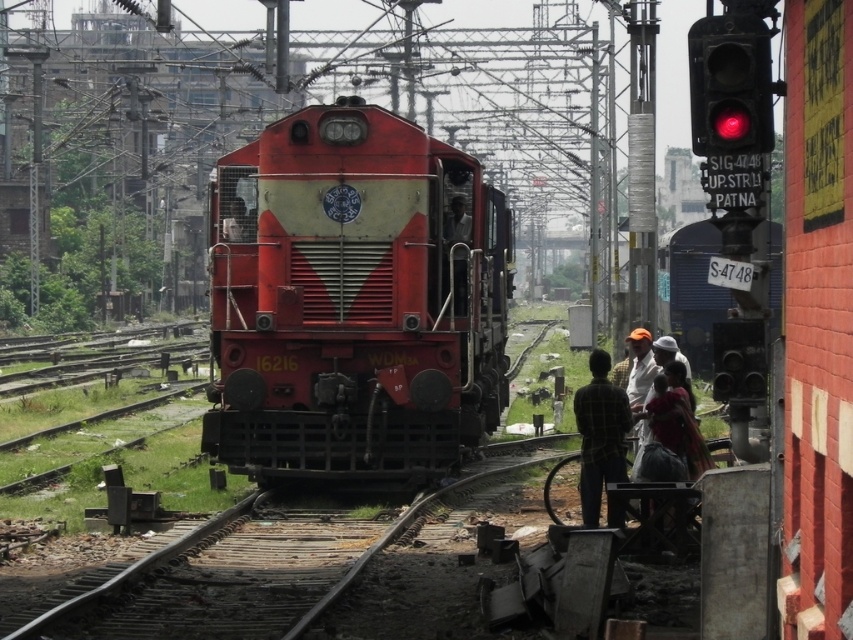
Is red glass traffic light at upper right to the left of matte black face at center from the viewer's perspective?

In fact, red glass traffic light at upper right is to the right of matte black face at center.

Does red glass traffic light at upper right have a smaller size compared to matte black face at center?

No.

I want to click on red glass traffic light at upper right, so tap(730, 84).

Which is more to the left, matte red locomotive at center or red glass traffic light at upper right?

Positioned to the left is matte red locomotive at center.

Does matte red locomotive at center appear on the left side of red glass traffic light at upper right?

Correct, you'll find matte red locomotive at center to the left of red glass traffic light at upper right.

Where is `matte red locomotive at center`? matte red locomotive at center is located at coordinates coord(352,300).

Does red glass traffic light at upper right have a larger size compared to plaid fabric shirt at center?

Correct, red glass traffic light at upper right is larger in size than plaid fabric shirt at center.

Is point (753, 108) less distant than point (604, 371)?

Yes, point (753, 108) is closer to viewer.

Locate an element on the screen. Image resolution: width=853 pixels, height=640 pixels. red glass traffic light at upper right is located at coordinates (730, 84).